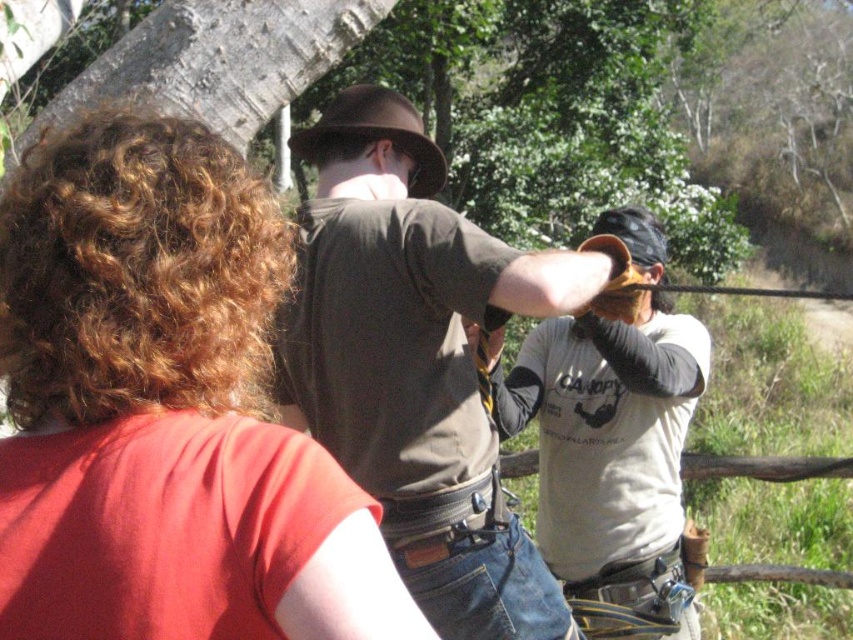
You are a photographer trying to capture a candid shot of the white cotton shirt at center without the matte red shirt at upper left blocking the view. Based on their positions, is this possible?

The matte red shirt at upper left is in front of the white cotton shirt at center, so it would block the view of the white cotton shirt at center. Therefore, capturing an unobstructed shot of the white cotton shirt at center without the matte red shirt at upper left blocking it is not possible.

You are a photographer positioned at the edge of the forest. You want to take a photo of the matte red shirt at upper left and the white cotton shirt at center. Based on their positions, which shirt should you focus on first to ensure both are in the frame?

The matte red shirt at upper left is above the white cotton shirt at center, so you should focus on the white cotton shirt at center first to ensure both are in the frame.

You are standing in a forest and see the matte brown shirt at center. If you want to reach it within 3 seconds, what is the minimum speed you need to move at?

The matte brown shirt at center is 6.34 feet away. To cover this distance in 3 seconds, you would need to move at a minimum speed of approximately 2.11 feet per second.